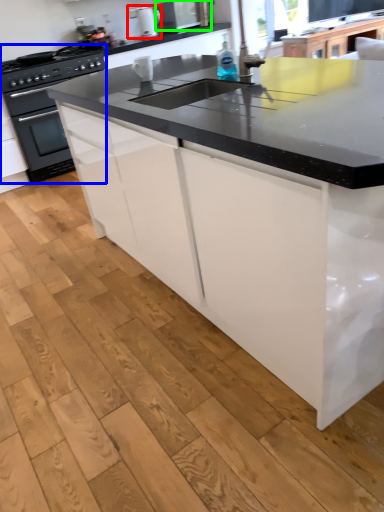
Question: Which object is the closest to the appliance (highlighted by a red box)? Choose among these: home appliance (highlighted by a blue box) or kitchen appliance (highlighted by a green box).

Choices:
 (A) home appliance
 (B) kitchen appliance

Answer: (B)